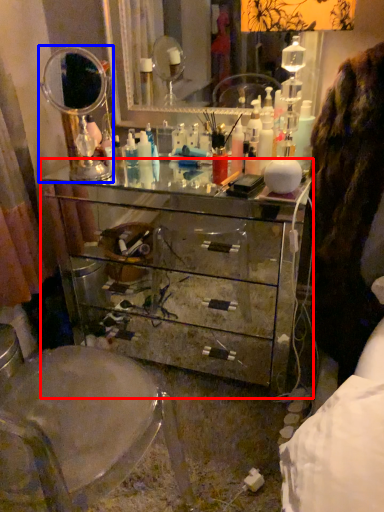
Question: Which point is further to the camera, chest of drawers (highlighted by a red box) or mirror (highlighted by a blue box)?

Choices:
 (A) chest of drawers
 (B) mirror

Answer: (B)